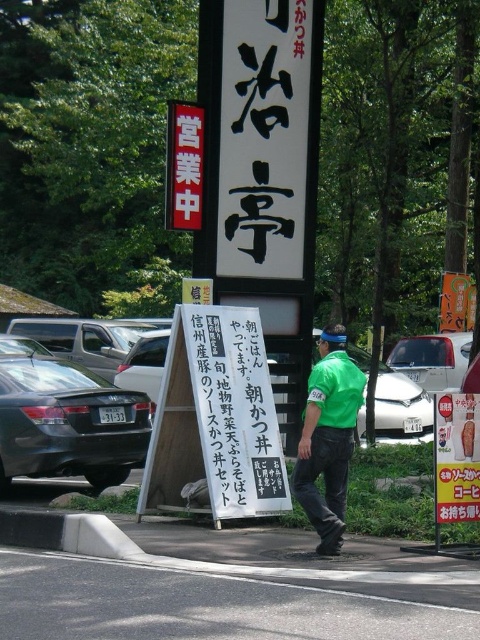
What do you see at coordinates (235, 412) in the screenshot? I see `black paper sign at center` at bounding box center [235, 412].

Does black paper sign at center have a smaller size compared to green fabric shirt at center?

Incorrect, black paper sign at center is not smaller in size than green fabric shirt at center.

The width and height of the screenshot is (480, 640). What do you see at coordinates (235, 412) in the screenshot? I see `black paper sign at center` at bounding box center [235, 412].

I want to click on black paper sign at center, so click(235, 412).